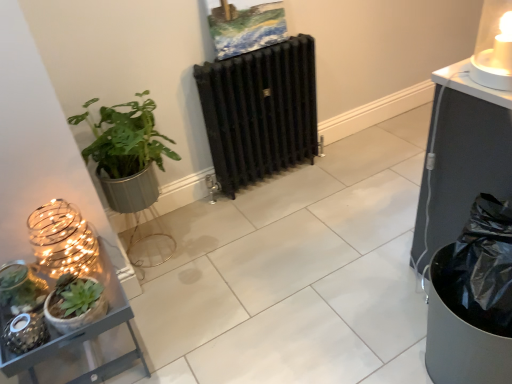
Question: Can you confirm if metallic gray shelf at lower left is wider than green matte plant at left, the 1th houseplant when ordered from back to front?

Choices:
 (A) no
 (B) yes

Answer: (B)

Question: From the image's perspective, does metallic gray shelf at lower left appear higher than green matte plant at left, which is counted as the 2th houseplant, starting from the front?

Choices:
 (A) yes
 (B) no

Answer: (B)

Question: From a real-world perspective, is metallic gray shelf at lower left on green matte plant at left, which is counted as the 2th houseplant, starting from the front?

Choices:
 (A) no
 (B) yes

Answer: (A)

Question: From a real-world perspective, is metallic gray shelf at lower left physically below green matte plant at left, the 1th houseplant when ordered from back to front?

Choices:
 (A) yes
 (B) no

Answer: (A)

Question: From the image's perspective, is metallic gray shelf at lower left under green matte plant at left, which is counted as the 2th houseplant, starting from the front?

Choices:
 (A) no
 (B) yes

Answer: (B)

Question: Is the depth of metallic gray shelf at lower left greater than that of green matte plant at left, which is counted as the 2th houseplant, starting from the front?

Choices:
 (A) yes
 (B) no

Answer: (B)

Question: From a real-world perspective, does matte gold wire candle holder at left, the 2th candle holder from the top, stand above green matte succulent at lower left, placed as the first houseplant when sorted from front to back?

Choices:
 (A) no
 (B) yes

Answer: (B)

Question: Considering the relative sizes of matte gold wire candle holder at left, the 2th candle holder from the top, and green matte succulent at lower left, which is the 2th houseplant in back-to-front order, in the image provided, is matte gold wire candle holder at left, the 2th candle holder from the top, bigger than green matte succulent at lower left, which is the 2th houseplant in back-to-front order,?

Choices:
 (A) no
 (B) yes

Answer: (B)

Question: Considering the relative positions of matte gold wire candle holder at left, the 2th candle holder from the top, and green matte succulent at lower left, placed as the first houseplant when sorted from front to back, in the image provided, is matte gold wire candle holder at left, the 2th candle holder from the top, behind green matte succulent at lower left, placed as the first houseplant when sorted from front to back,?

Choices:
 (A) yes
 (B) no

Answer: (A)

Question: From a real-world perspective, is matte gold wire candle holder at left, the 2th candle holder from the top, under green matte succulent at lower left, which is the 2th houseplant in back-to-front order?

Choices:
 (A) no
 (B) yes

Answer: (A)

Question: Can you confirm if matte gold wire candle holder at left, the 2th candle holder positioned from the right, is shorter than green matte succulent at lower left, which is the 2th houseplant in back-to-front order?

Choices:
 (A) yes
 (B) no

Answer: (B)

Question: Does matte gold wire candle holder at left, the 1th candle holder in the left-to-right sequence, have a greater width compared to green matte succulent at lower left, placed as the first houseplant when sorted from front to back?

Choices:
 (A) yes
 (B) no

Answer: (A)

Question: Does black cast iron radiator at center have a lesser width compared to translucent glass candle at upper right, which appears as the 1th candle holder when viewed from the top?

Choices:
 (A) no
 (B) yes

Answer: (B)